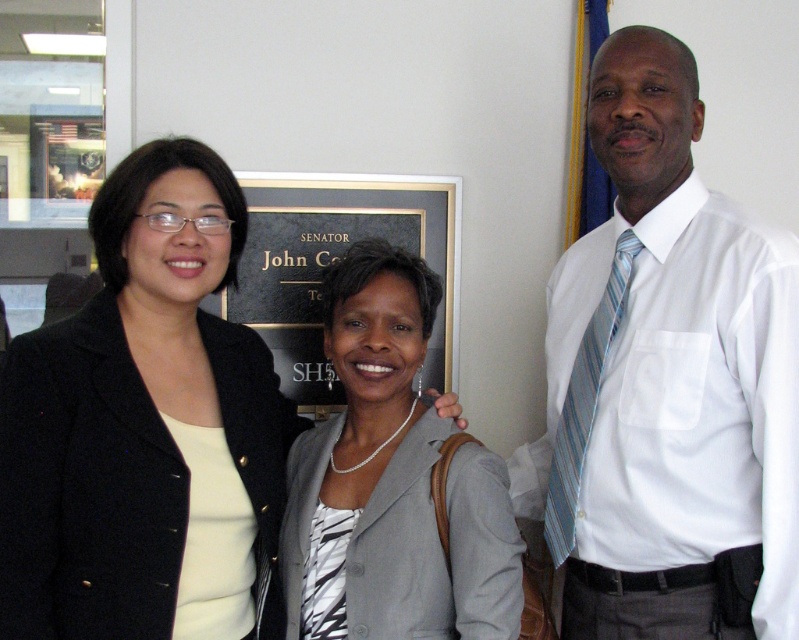
In the scene described, there are two items of clothing visible on the people present. The gray fabric jacket at center and the blue striped tie at right. From the perspective of someone standing in front of them, which of these items is positioned more to the left?

The gray fabric jacket at center is positioned more to the left than the blue striped tie at right.

Consider the image. What is the color of the fabric at the point labeled as point [392,481]?

The gray fabric jacket at center is represented by point [392,481], so the color is gray.